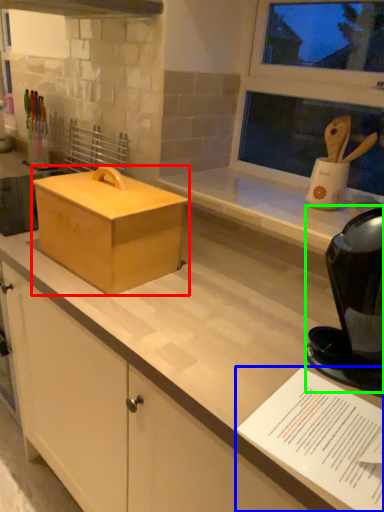
Question: Which object is positioned farthest from box (highlighted by a red box)? Select from paper (highlighted by a blue box) and appliance (highlighted by a green box).

Choices:
 (A) paper
 (B) appliance

Answer: (A)